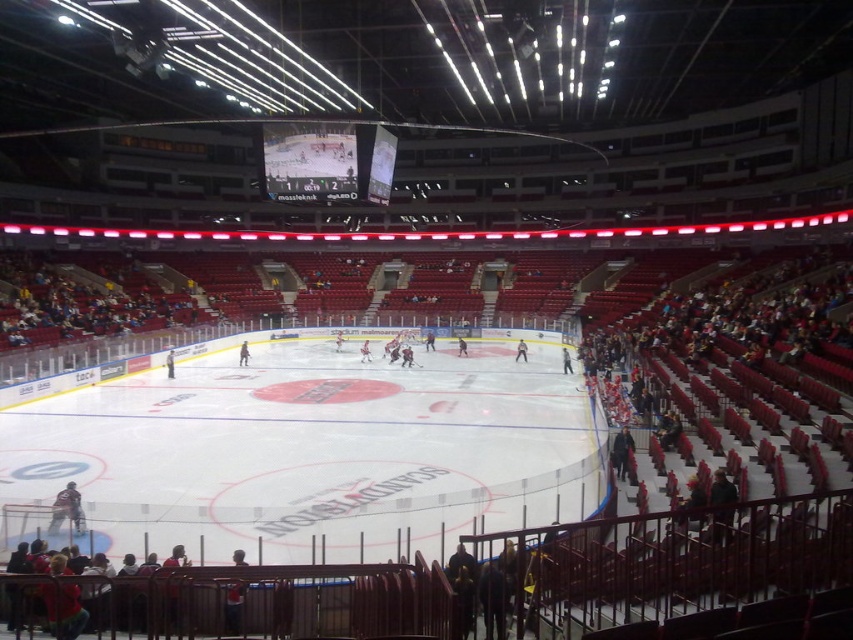
Can you confirm if white smooth ice at center is positioned to the right of matte digital scoreboard at center?

Yes, white smooth ice at center is to the right of matte digital scoreboard at center.

Does point (30, 404) come closer to viewer compared to point (376, 172)?

Yes.

Image resolution: width=853 pixels, height=640 pixels. I want to click on white smooth ice at center, so click(x=309, y=452).

What are the coordinates of `white smooth ice at center` in the screenshot? It's located at (309, 452).